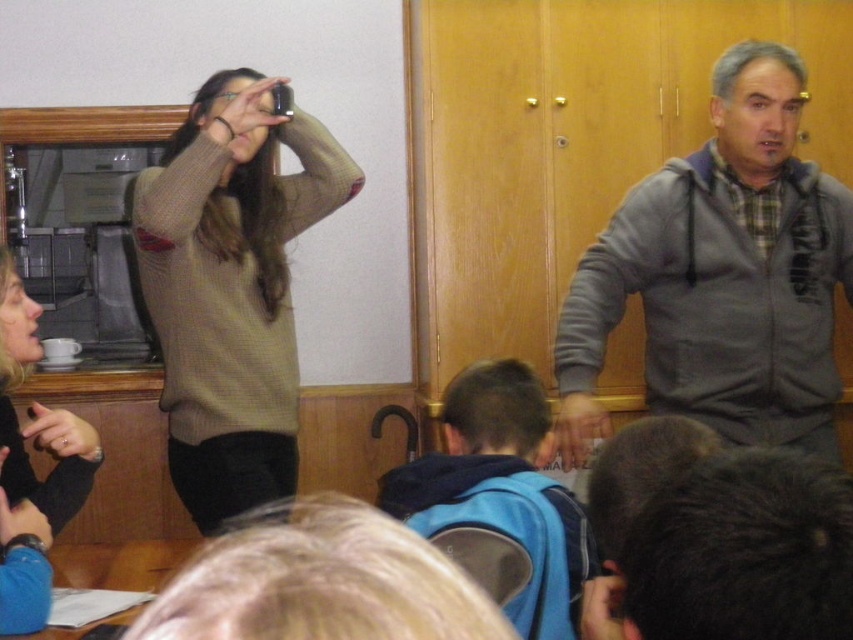
You are standing in the room and want to hand a document to the person wearing the black matte jacket at lower left. Based on their position, where should you approach from to ensure they can see you?

The black matte jacket at lower left is located at point 0.652 on the horizontal axis and 0.046 on the vertical axis, which places them near the lower left corner of the frame. To approach them effectively, you should come from the left or behind to ensure they notice you.

You are sitting at the table in the scene. You want to pass a pen from the matte black hair at upper left to the matte gray hand at lower center. Which direction should you move the pen?

The matte black hair at upper left is to the left of the matte gray hand at lower center, so you should move the pen to the right to reach the matte gray hand at lower center.